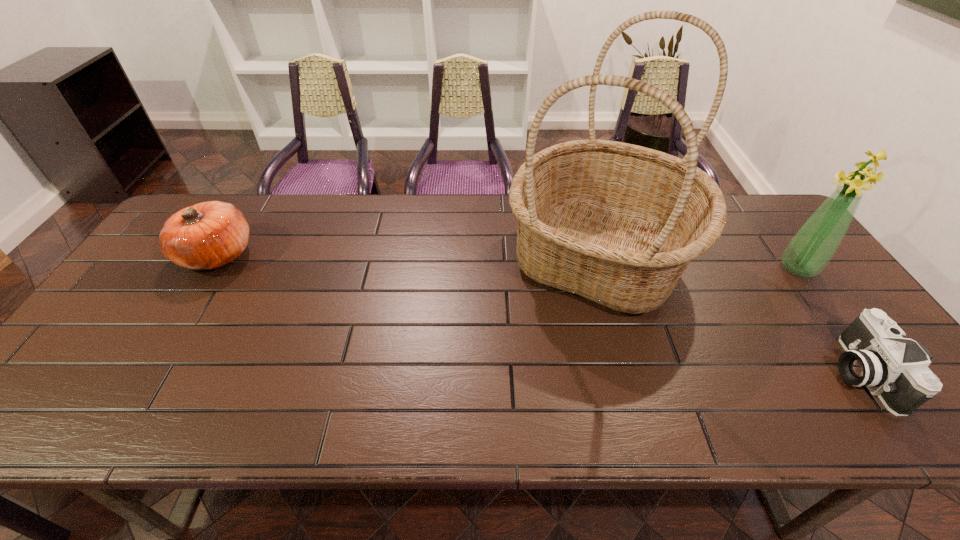
Locate an element on the screen. The width and height of the screenshot is (960, 540). the second object from left to right is located at coordinates (616, 223).

In order to click on basket in this screenshot , I will do `click(616, 223)`.

Locate an element on the screen. Image resolution: width=960 pixels, height=540 pixels. the third shortest object is located at coordinates (x=810, y=250).

Identify the location of the leftmost object. The image size is (960, 540). 205,236.

Locate an element on the screen. The width and height of the screenshot is (960, 540). the second shortest object is located at coordinates (205, 236).

The width and height of the screenshot is (960, 540). I want to click on camera, so click(876, 356).

Identify the location of the shortest object. (876, 356).

Where is `vacant region located on the right of the third object from right to left`? Image resolution: width=960 pixels, height=540 pixels. vacant region located on the right of the third object from right to left is located at coordinates (745, 257).

Find the location of `free space located on the front-facing side of the bouquet`. free space located on the front-facing side of the bouquet is located at coordinates (734, 268).

This screenshot has height=540, width=960. I want to click on free space located on the front-facing side of the bouquet, so click(727, 268).